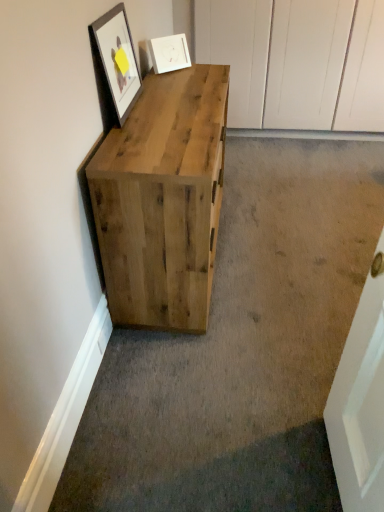
Question: Relative to matte black frame at upper left, which is counted as the first picture frame, starting from the front, is natural wood chest of drawers at left in front or behind?

Choices:
 (A) behind
 (B) front

Answer: (B)

Question: Which is correct: natural wood chest of drawers at left is inside matte black frame at upper left, which ranks as the 2th picture frame in back-to-front order, or outside of it?

Choices:
 (A) outside
 (B) inside

Answer: (A)

Question: Considering the real-world distances, which object is closest to the white matte picture frame at upper center, acting as the first picture frame starting from the back?

Choices:
 (A) natural wood chest of drawers at left
 (B) matte black frame at upper left, which appears as the 1th picture frame when viewed from the left

Answer: (B)

Question: Which object is the farthest from the white matte picture frame at upper center, acting as the first picture frame starting from the back?

Choices:
 (A) matte black frame at upper left, which ranks as the 2th picture frame in right-to-left order
 (B) natural wood chest of drawers at left

Answer: (B)